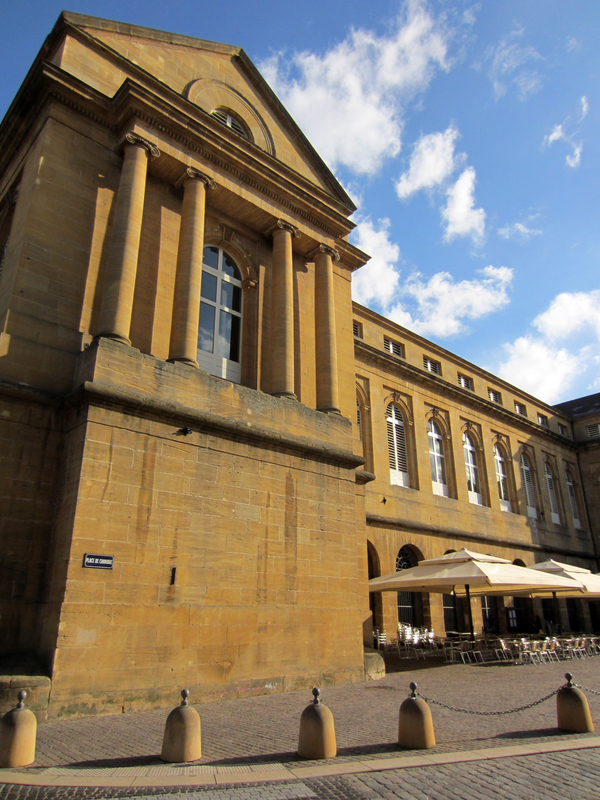
Locate an element on the screen. Image resolution: width=600 pixels, height=800 pixels. chair is located at coordinates (536, 649).